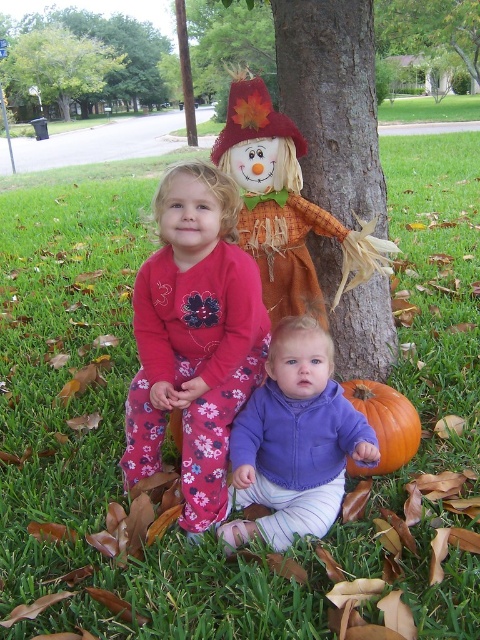
Does pink fleece pajamas at center appear on the right side of green leafy tree at upper left?

Yes, pink fleece pajamas at center is to the right of green leafy tree at upper left.

Does pink fleece pajamas at center appear under green leafy tree at upper left?

Correct, pink fleece pajamas at center is located below green leafy tree at upper left.

Between point (191, 177) and point (25, 70), which one is positioned in front?

Point (191, 177) is in front.

Where is `pink fleece pajamas at center`? pink fleece pajamas at center is located at coordinates (193, 339).

Is point (324, 353) positioned before point (253, 237)?

Yes, it is in front of point (253, 237).

The width and height of the screenshot is (480, 640). Describe the element at coordinates (295, 442) in the screenshot. I see `purple fleece jacket at lower center` at that location.

Locate an element on the screen. This screenshot has width=480, height=640. purple fleece jacket at lower center is located at coordinates coord(295,442).

Between pink fleece pajamas at center and matte orange scarecrow at center, which one is positioned lower?

Positioned lower is pink fleece pajamas at center.

Between pink fleece pajamas at center and matte orange scarecrow at center, which one has more height?

Standing taller between the two is pink fleece pajamas at center.

Who is more forward, (167, 236) or (220, 164)?

Point (167, 236)

This screenshot has width=480, height=640. I want to click on pink fleece pajamas at center, so click(x=193, y=339).